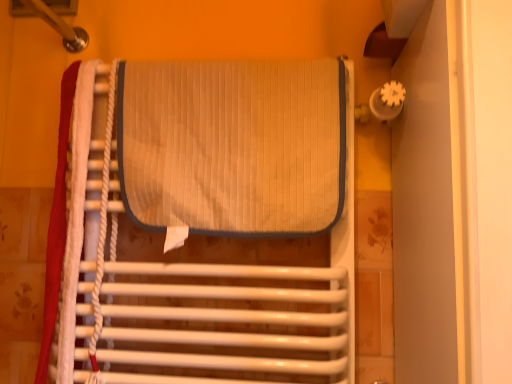
Question: From the image's perspective, is beige textured mat at center above textured beige mat at center?

Choices:
 (A) yes
 (B) no

Answer: (A)

Question: Does beige textured mat at center have a lesser height compared to textured beige mat at center?

Choices:
 (A) no
 (B) yes

Answer: (B)

Question: Can you confirm if beige textured mat at center is positioned to the right of textured beige mat at center?

Choices:
 (A) no
 (B) yes

Answer: (A)

Question: Could you tell me if beige textured mat at center is turned towards textured beige mat at center?

Choices:
 (A) yes
 (B) no

Answer: (A)

Question: Is the surface of beige textured mat at center in direct contact with textured beige mat at center?

Choices:
 (A) yes
 (B) no

Answer: (A)

Question: Is textured beige mat at center surrounded by beige textured mat at center?

Choices:
 (A) yes
 (B) no

Answer: (B)

Question: From the image's perspective, is white rope at left located beneath textured beige mat at center?

Choices:
 (A) yes
 (B) no

Answer: (B)

Question: Is white rope at left closer to the viewer compared to textured beige mat at center?

Choices:
 (A) no
 (B) yes

Answer: (A)

Question: Could you tell me if white rope at left is facing textured beige mat at center?

Choices:
 (A) yes
 (B) no

Answer: (A)

Question: Does white rope at left have a larger size compared to textured beige mat at center?

Choices:
 (A) no
 (B) yes

Answer: (A)

Question: Can you confirm if white rope at left is positioned to the right of textured beige mat at center?

Choices:
 (A) yes
 (B) no

Answer: (B)

Question: Could textured beige mat at center be considered to be inside white rope at left?

Choices:
 (A) no
 (B) yes

Answer: (A)

Question: From a real-world perspective, is white rope at left below beige textured mat at center?

Choices:
 (A) no
 (B) yes

Answer: (B)